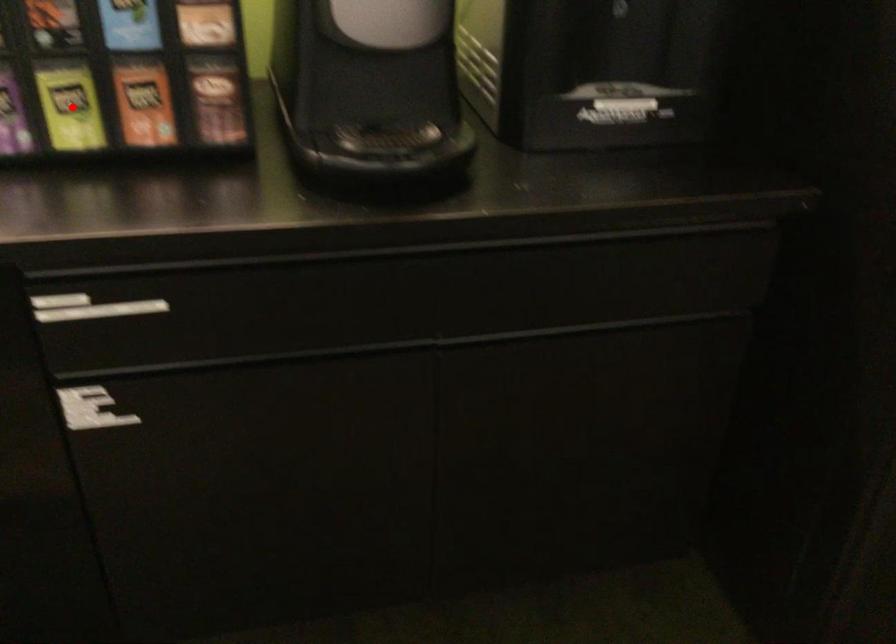
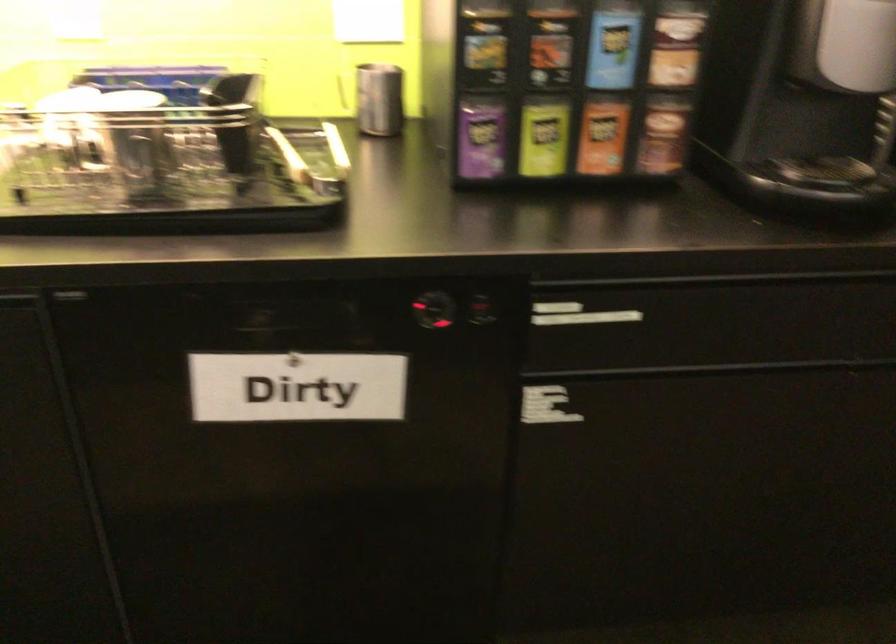
Where in the second image is the point corresponding to the highlighted location from the first image?

(543, 138)